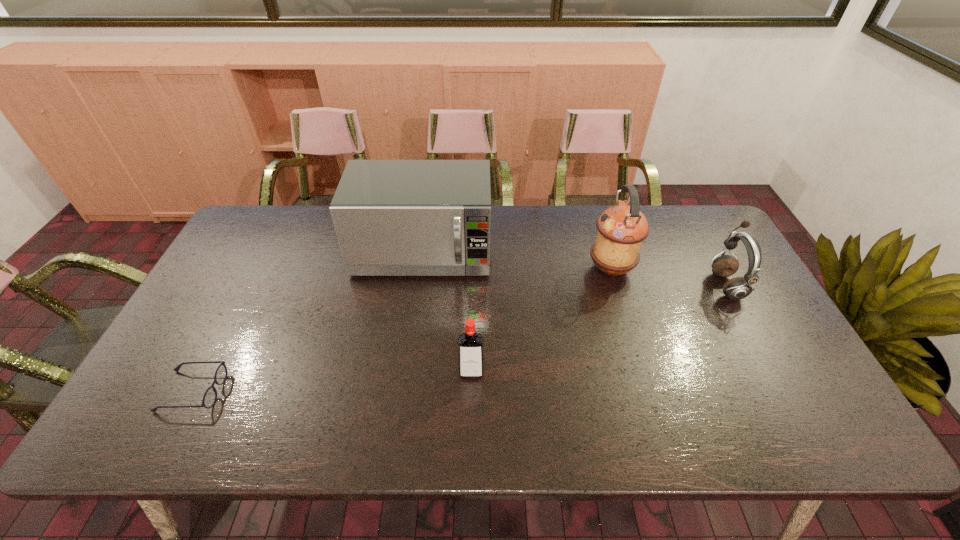
The width and height of the screenshot is (960, 540). I want to click on the fourth object from left to right, so point(621,228).

This screenshot has height=540, width=960. What are the coordinates of `microwave oven` in the screenshot? It's located at (392, 217).

Where is `earphone`? This screenshot has height=540, width=960. earphone is located at coordinates (737, 288).

Where is `vodka`? The height and width of the screenshot is (540, 960). vodka is located at coordinates (470, 343).

Locate an element on the screen. spectacles is located at coordinates (209, 399).

Locate an element on the screen. The height and width of the screenshot is (540, 960). the shortest object is located at coordinates (209, 399).

Locate an element on the screen. Image resolution: width=960 pixels, height=540 pixels. free space located 0.050m on the left of the oil lamp is located at coordinates (571, 268).

At what (x,y) coordinates should I click in order to perform the action: click on free region located with the door open on the microwave oven. Please return your answer as a coordinate pair (x, y). This screenshot has height=540, width=960. Looking at the image, I should click on (405, 380).

The width and height of the screenshot is (960, 540). I want to click on vacant region located 0.160m on the ear pads of the earphone, so click(x=659, y=285).

Locate an element on the screen. free space located on the ear pads of the earphone is located at coordinates (683, 285).